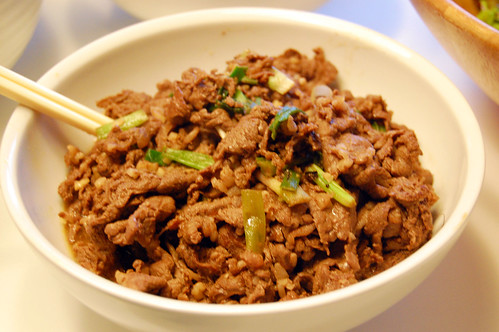
This screenshot has width=499, height=332. In order to click on white tabletop in this screenshot , I will do `click(31, 298)`, `click(456, 312)`, `click(398, 20)`, `click(83, 26)`.